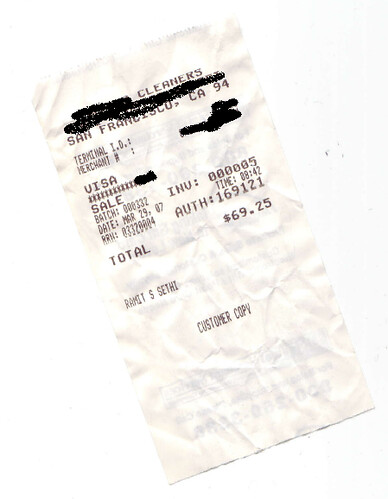
Locate an element on the screen. black marker is located at coordinates (184, 172), (118, 103).